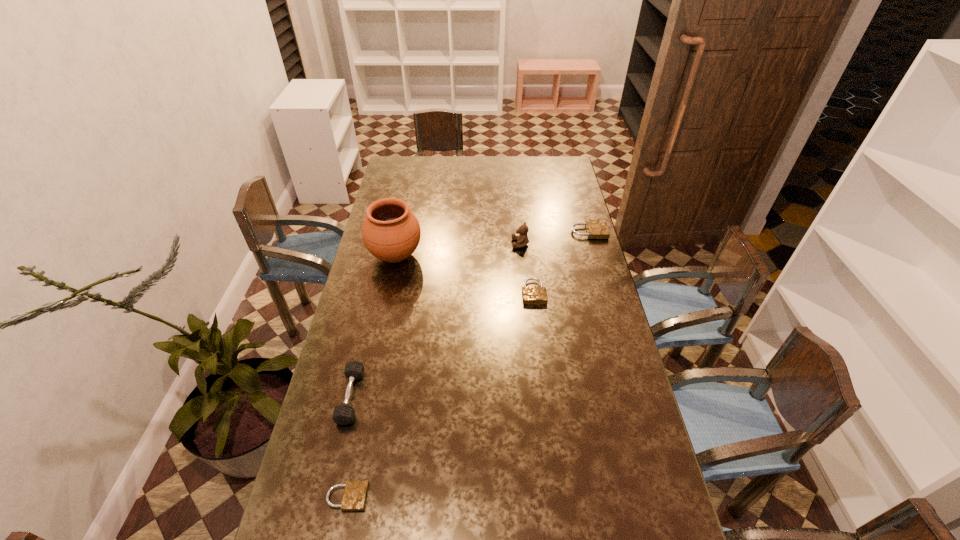
The height and width of the screenshot is (540, 960). What are the coordinates of `vacant area that satisfies the following two spatial constraints: 1. on the keyhole side of the rightmost object; 2. on the front side of the second nearest object` in the screenshot? It's located at (636, 396).

Identify the location of free space that satisfies the following two spatial constraints: 1. on the back side of the pottery; 2. on the left side of the fifth farthest object. (384, 256).

Where is `free region that satisfies the following two spatial constraints: 1. on the keyhole side of the rightmost padlock; 2. on the front side of the tallest object`? The width and height of the screenshot is (960, 540). free region that satisfies the following two spatial constraints: 1. on the keyhole side of the rightmost padlock; 2. on the front side of the tallest object is located at coordinates (595, 256).